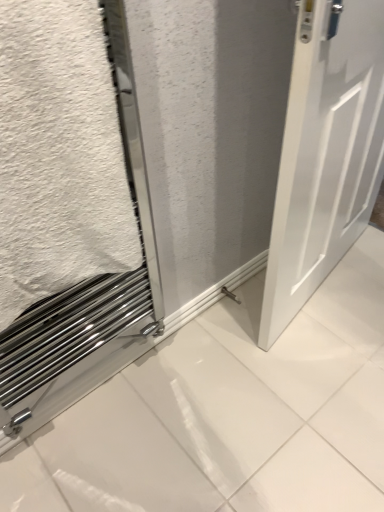
Question: Would you say white matte door at right is inside or outside white matte towel at lower left?

Choices:
 (A) inside
 (B) outside

Answer: (B)

Question: Considering their positions, is white matte door at right located in front of or behind white matte towel at lower left?

Choices:
 (A) behind
 (B) front

Answer: (A)

Question: From a real-world perspective, is white matte door at right positioned above or below white matte towel at lower left?

Choices:
 (A) above
 (B) below

Answer: (B)

Question: Considering the positions of white matte towel at lower left and white matte door at right in the image, is white matte towel at lower left wider or thinner than white matte door at right?

Choices:
 (A) wide
 (B) thin

Answer: (A)

Question: Is point (49, 206) positioned closer to the camera than point (286, 297)?

Choices:
 (A) closer
 (B) farther

Answer: (A)

Question: From their relative heights in the image, would you say white matte towel at lower left is taller or shorter than white matte door at right?

Choices:
 (A) short
 (B) tall

Answer: (A)

Question: Is white matte towel at lower left situated inside white matte door at right or outside?

Choices:
 (A) inside
 (B) outside

Answer: (B)